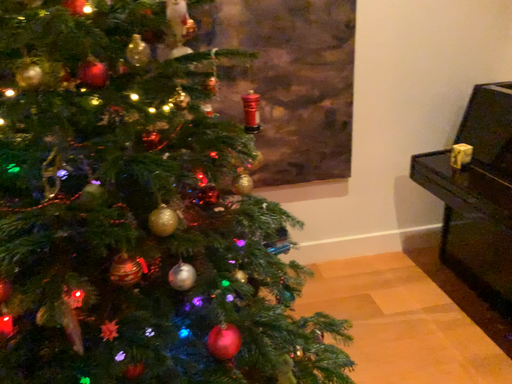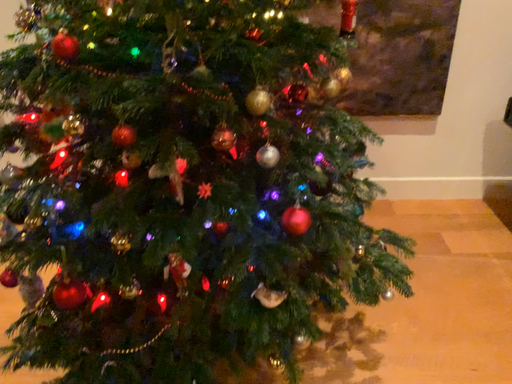
Question: Which way did the camera rotate in the video?

Choices:
 (A) rotated downward
 (B) rotated upward

Answer: (A)